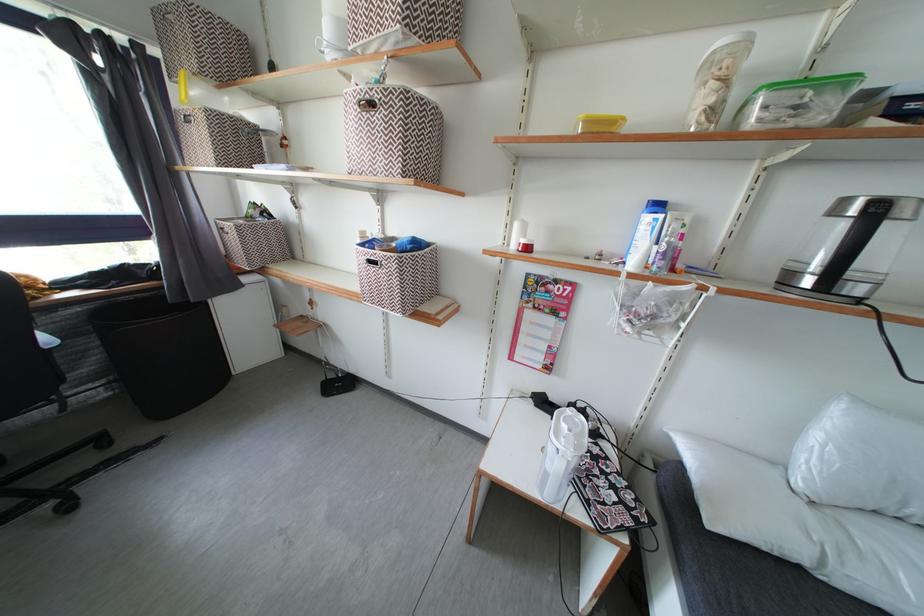
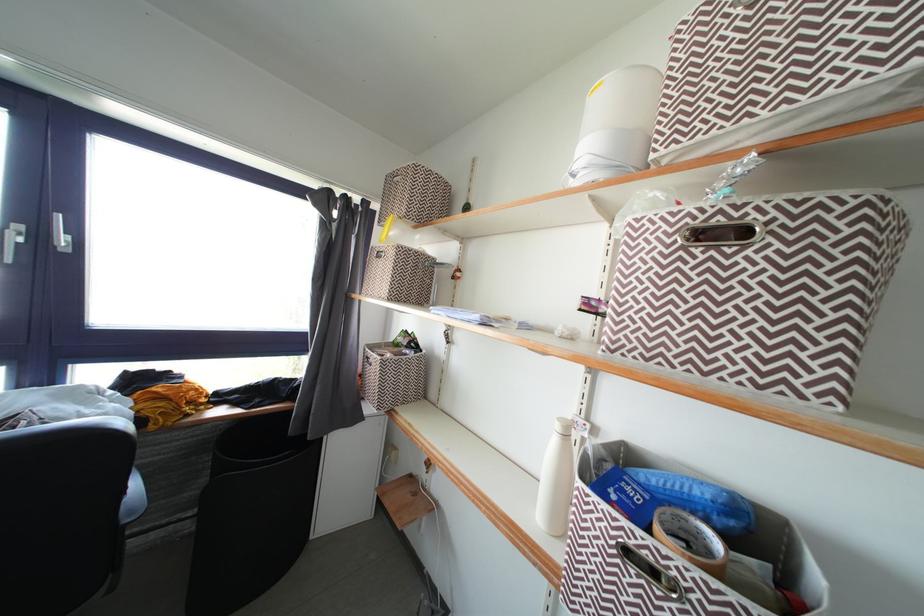
In the second image, find the point that corresponds to [416,252] in the first image.

(724, 525)